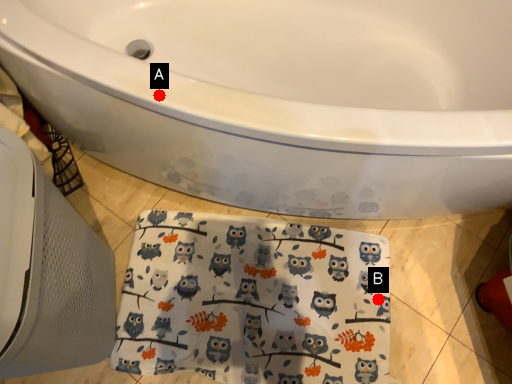
Question: Two points are circled on the image, labeled by A and B beside each circle. Which point is closer to the camera?

Choices:
 (A) A is closer
 (B) B is closer

Answer: (A)